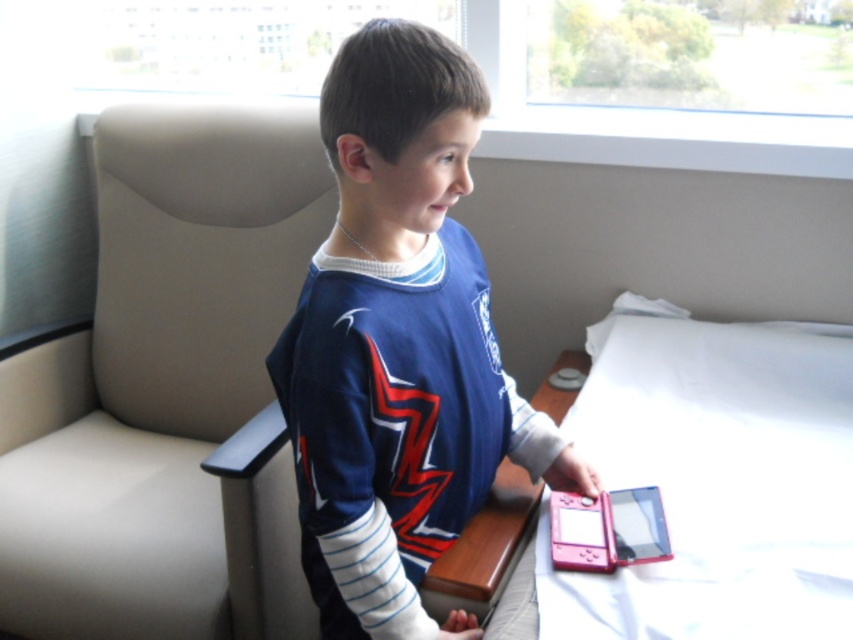
Who is higher up, blue jersey at center or pink plastic tablet at lower right?

blue jersey at center is higher up.

Does blue jersey at center appear under pink plastic tablet at lower right?

Actually, blue jersey at center is above pink plastic tablet at lower right.

Who is more distant from viewer, (465, 406) or (654, 532)?

The point (654, 532) is behind.

Where is `blue jersey at center`? The image size is (853, 640). blue jersey at center is located at coordinates (399, 346).

Does pink plastic game console at lower right have a larger size compared to pink plastic tablet at lower right?

Yes.

Looking at this image, is pink plastic game console at lower right closer to the viewer compared to pink plastic tablet at lower right?

No.

Between point (583, 525) and point (614, 531), which one is positioned in front?

Positioned in front is point (614, 531).

This screenshot has width=853, height=640. I want to click on pink plastic game console at lower right, so click(x=581, y=532).

Between blue jersey at center and pink plastic bed at lower right, which one is positioned higher?

blue jersey at center

Is blue jersey at center below pink plastic bed at lower right?

Actually, blue jersey at center is above pink plastic bed at lower right.

Find the location of a particular element. blue jersey at center is located at coordinates (399, 346).